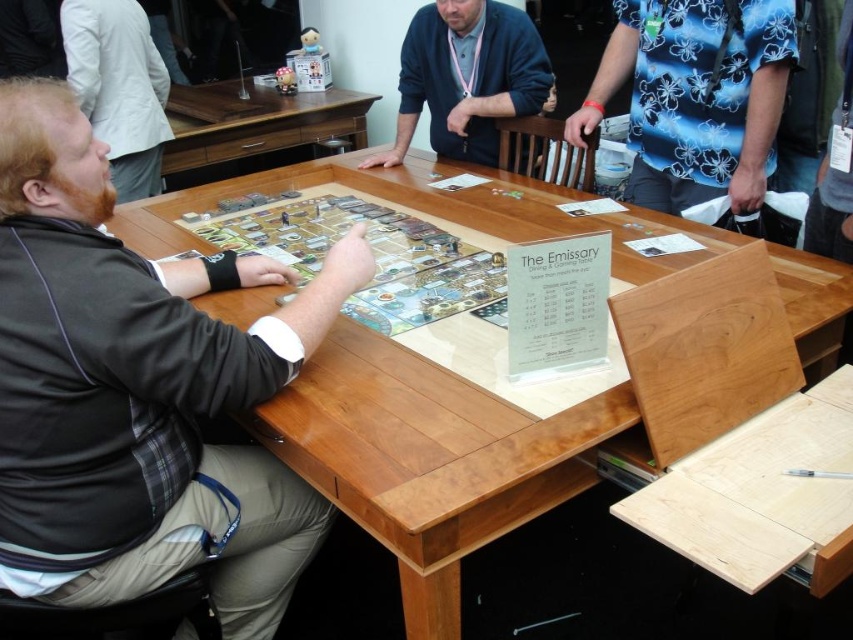
You are a photographer at the convention and want to capture a photo of both the dark gray jacket at left and the dark blue sweater at center without any obstruction. Based on their positions, which one should you focus on first to ensure both are visible in the frame?

The dark gray jacket at left is in front of the dark blue sweater at center. To ensure both are visible without obstruction, focus on the dark blue sweater at center first, then adjust the camera angle slightly to include the dark gray jacket at left in the foreground without blocking it.

You are at the gaming convention and want to know if the wooden board game at center can fit on a shelf that is the same width as the dark brown leather jacket at left. Can it fit?

The wooden board game at center is wider than the dark brown leather jacket at left, so it cannot fit on a shelf with the same width as the jacket.